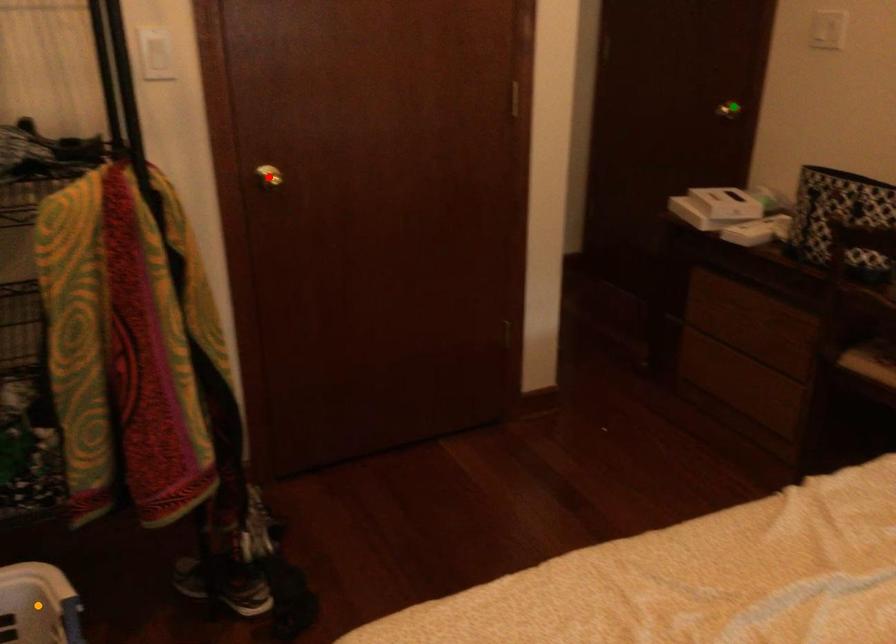
Order these from nearest to farthest:
red point, orange point, green point

orange point → red point → green point